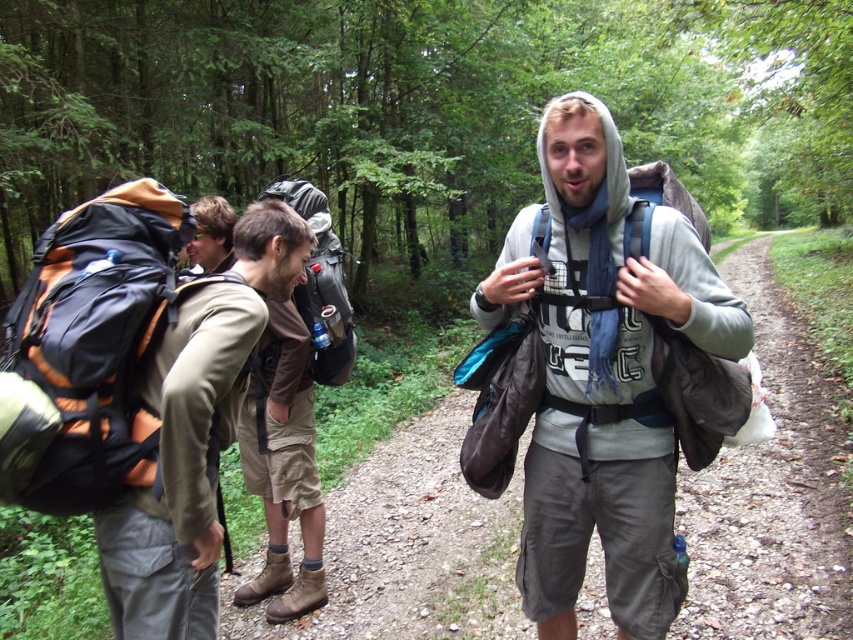
Between orange fabric backpack at left and matte khaki pants at center, which one has less height?

orange fabric backpack at left is shorter.

Is orange fabric backpack at left below matte khaki pants at center?

Actually, orange fabric backpack at left is above matte khaki pants at center.

Find the location of a particular element. This screenshot has width=853, height=640. orange fabric backpack at left is located at coordinates (91, 348).

Who is positioned more to the left, gray fabric hoodie at center or matte khaki pants at center?

From the viewer's perspective, matte khaki pants at center appears more on the left side.

Between point (618, 492) and point (262, 228), which one is positioned in front?

Point (618, 492) is more forward.

Which is in front, point (575, 540) or point (189, 336)?

Positioned in front is point (189, 336).

The width and height of the screenshot is (853, 640). What are the coordinates of `gray fabric hoodie at center` in the screenshot? It's located at (602, 374).

Is matte khaki pants at center smaller than matte black backpack at center?

Incorrect, matte khaki pants at center is not smaller in size than matte black backpack at center.

Find the location of a particular element. The height and width of the screenshot is (640, 853). matte khaki pants at center is located at coordinates (195, 435).

At what (x,y) coordinates should I click in order to perform the action: click on matte khaki pants at center. Please return your answer as a coordinate pair (x, y). This screenshot has width=853, height=640. Looking at the image, I should click on (195, 435).